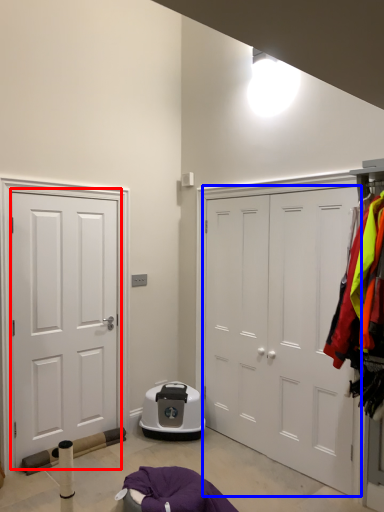
Question: Which object appears closest to the camera in this image, door (highlighted by a red box) or door (highlighted by a blue box)?

Choices:
 (A) door
 (B) door

Answer: (B)